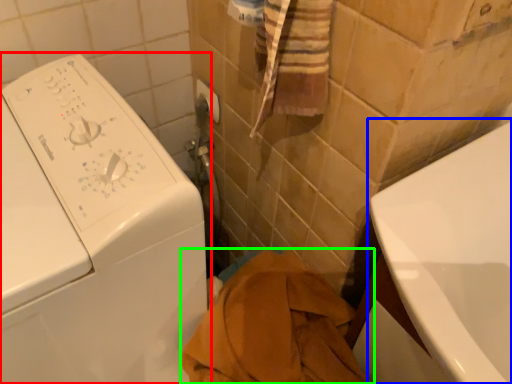
Question: Which is farther away from washing machine (highlighted by a red box)? bath (highlighted by a blue box) or bath towel (highlighted by a green box)?

Choices:
 (A) bath
 (B) bath towel

Answer: (A)